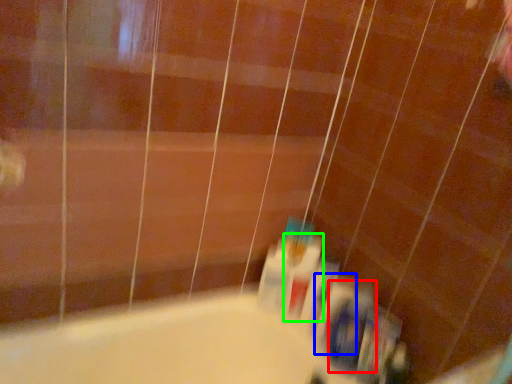
Question: Which is farther away from toiletry (highlighted by a red box)? toiletry (highlighted by a blue box) or mouthwash (highlighted by a green box)?

Choices:
 (A) toiletry
 (B) mouthwash

Answer: (B)